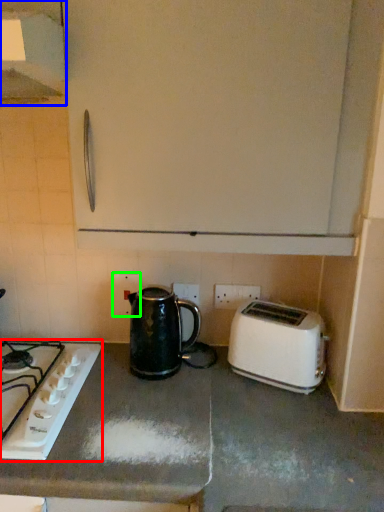
Question: Which object is the farthest from gas stove (highlighted by a red box)? Choose among these: exhaust hood (highlighted by a blue box) or electric outlet (highlighted by a green box).

Choices:
 (A) exhaust hood
 (B) electric outlet

Answer: (A)